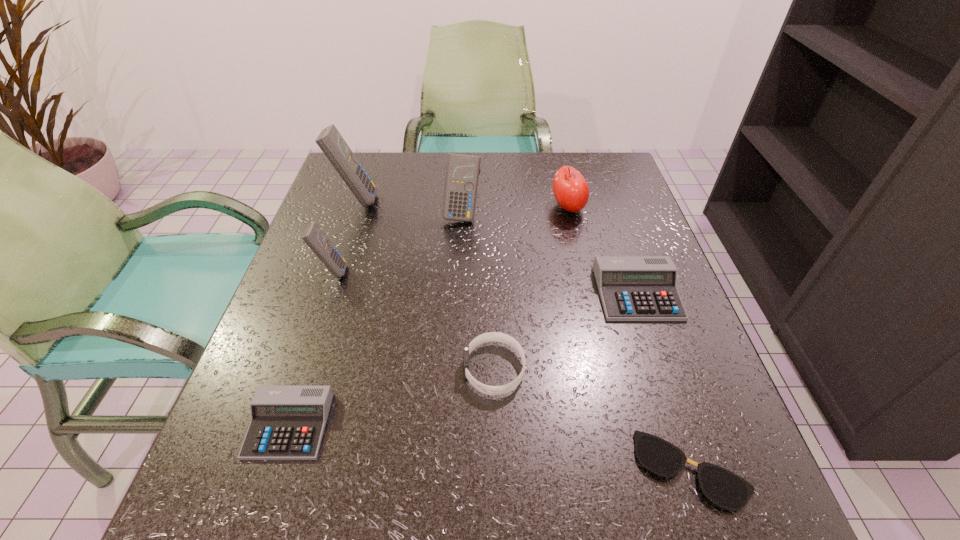
The height and width of the screenshot is (540, 960). I want to click on vacant space that satisfies the following two spatial constraints: 1. on the front-facing side of the shortest object; 2. on the left side of the second tallest object, so click(450, 469).